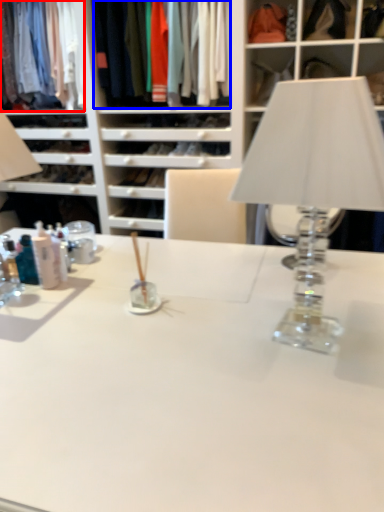
Question: Which point is closer to the camera, clothing (highlighted by a red box) or clothing (highlighted by a blue box)?

Choices:
 (A) clothing
 (B) clothing

Answer: (B)